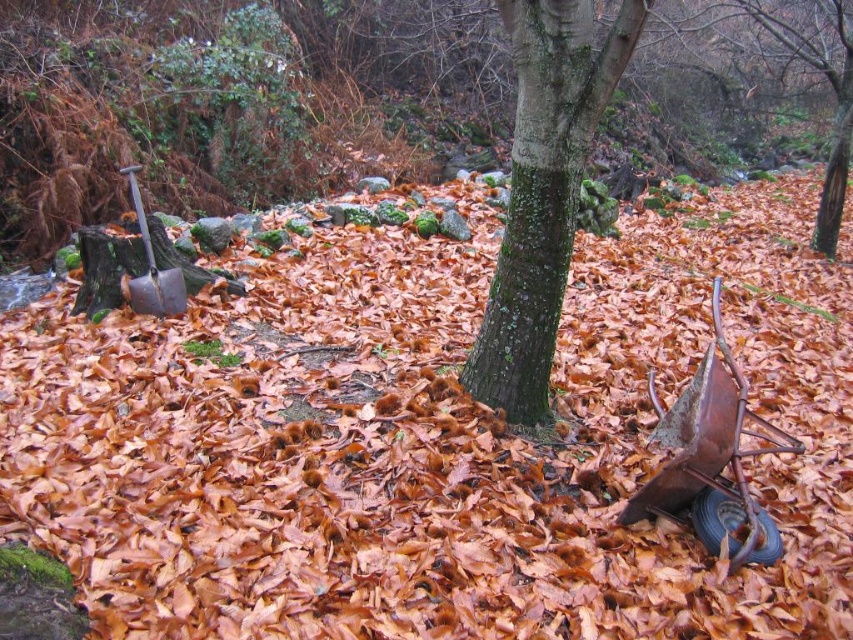
Question: Is green mossy bark tree at center wider than shiny metallic shovel at left?

Choices:
 (A) no
 (B) yes

Answer: (B)

Question: Which object is farther from the camera taking this photo?

Choices:
 (A) green mossy bark tree at center
 (B) shiny metallic shovel at left

Answer: (B)

Question: Observing the image, what is the correct spatial positioning of green mossy bark tree at center in reference to shiny metallic shovel at left?

Choices:
 (A) above
 (B) below

Answer: (A)

Question: Does green mossy bark tree at center have a lesser width compared to shiny metallic shovel at left?

Choices:
 (A) yes
 (B) no

Answer: (B)

Question: Among these points, which one is nearest to the camera?

Choices:
 (A) (132, 296)
 (B) (508, 388)

Answer: (B)